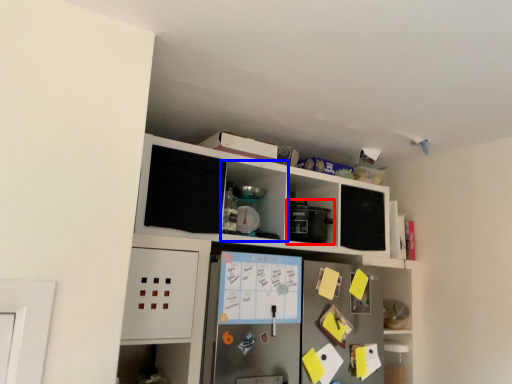
Question: Which object is closer to the camera taking this photo, appliance (highlighted by a red box) or cabinet (highlighted by a blue box)?

Choices:
 (A) appliance
 (B) cabinet

Answer: (B)